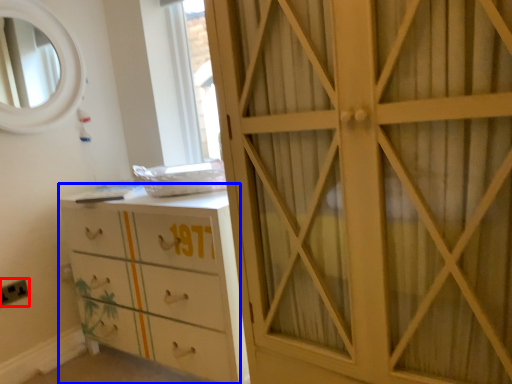
Question: Which object appears closest to the camera in this image, electric outlet (highlighted by a red box) or chest of drawers (highlighted by a blue box)?

Choices:
 (A) electric outlet
 (B) chest of drawers

Answer: (B)